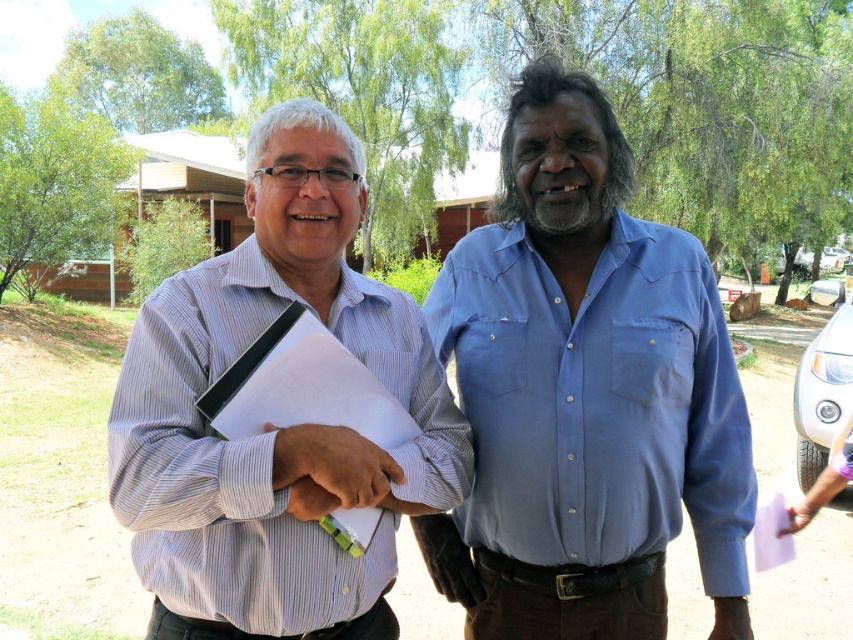
Question: Which point is farther from the camera taking this photo?

Choices:
 (A) (431, 284)
 (B) (234, 502)

Answer: (A)

Question: Can you confirm if white striped shirt at left is positioned to the left of blue cotton shirt at center?

Choices:
 (A) yes
 (B) no

Answer: (A)

Question: Based on their relative distances, which object is farther from the blue cotton shirt at center?

Choices:
 (A) white striped shirt at left
 (B) white paper at left

Answer: (B)

Question: Can you confirm if white striped shirt at left is positioned above blue cotton shirt at center?

Choices:
 (A) yes
 (B) no

Answer: (A)

Question: Which point is farther to the camera?

Choices:
 (A) blue cotton shirt at center
 (B) white paper at left

Answer: (A)

Question: Can you confirm if blue cotton shirt at center is wider than white paper at left?

Choices:
 (A) yes
 (B) no

Answer: (A)